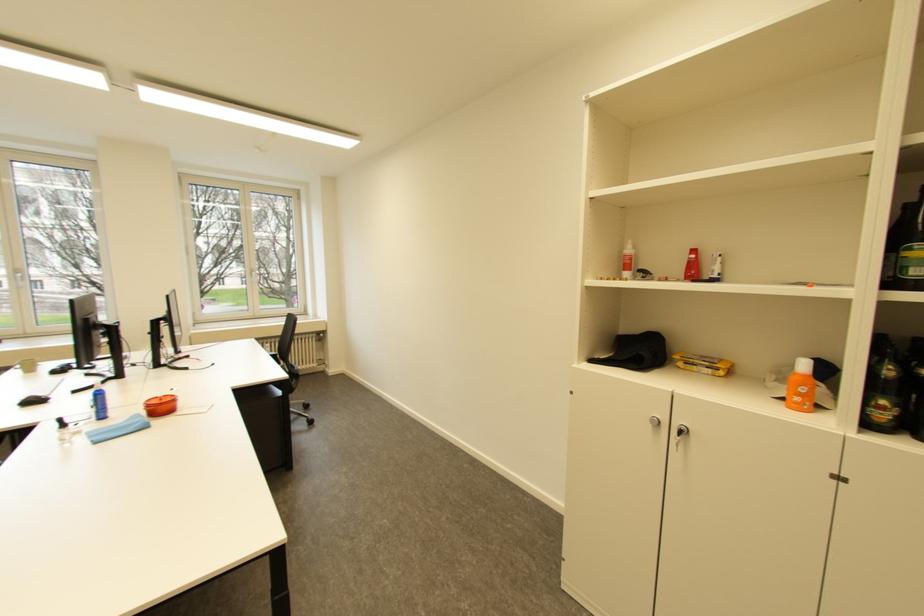
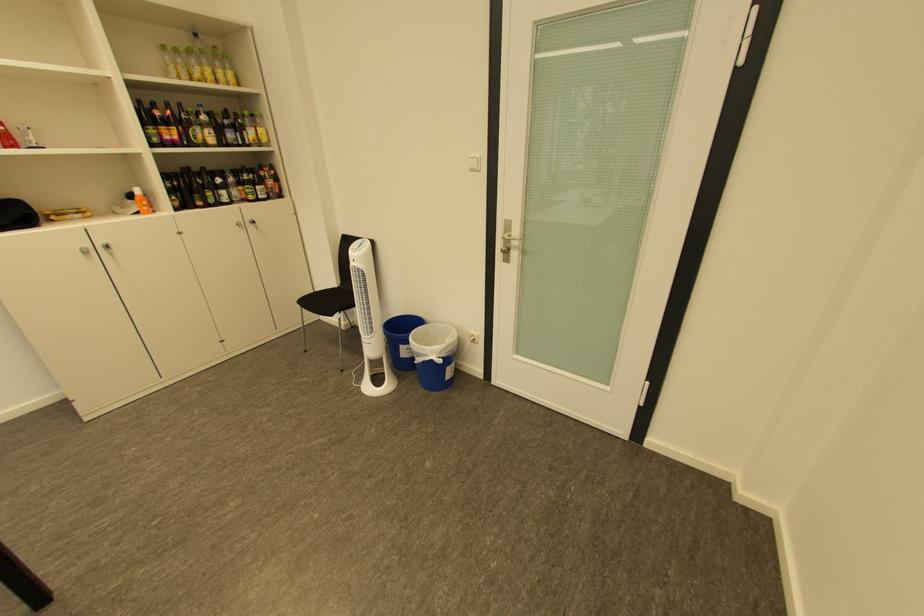
In the second image, find the point that corresponds to [792,400] in the first image.

(148, 214)